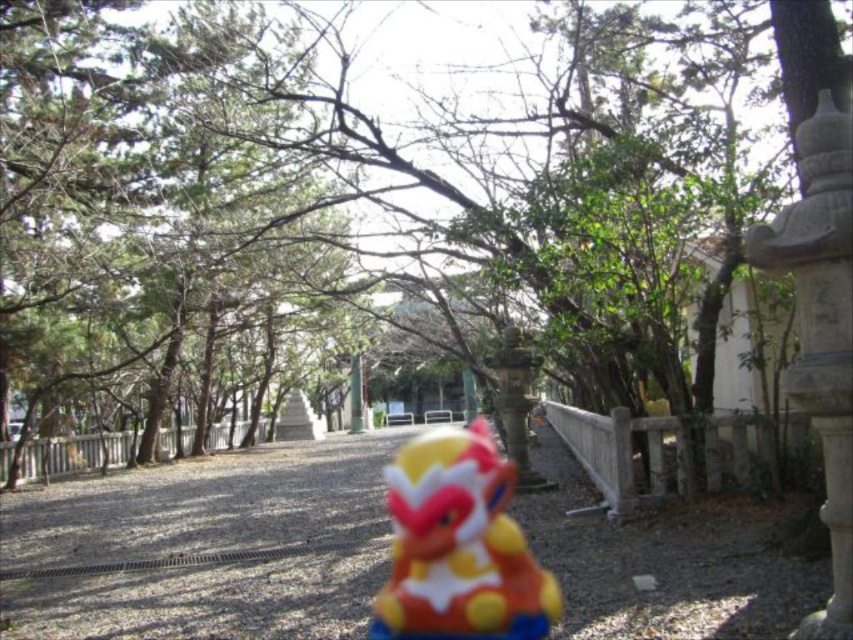
You are a gardener who needs to place a new decorative item on the path. Given the smooth gravel path at center and the matte plastic toy at center, which object is wider and can accommodate the item?

The smooth gravel path at center is wider than the matte plastic toy at center, so it can accommodate the new decorative item.

You are standing at the entrance of the temple grounds and see the point marked at coordinate (202, 547). Is this point located on the gravel path or on the wooden railing?

The point at coordinate (202, 547) is on the smooth gravel path at center, so the point is located on the gravel path.

You are a small robot with a width of 30 cm. You are standing at the start of the smooth gravel path at center. There is a matte plastic toy at center blocking your path. Can you navigate around the toy without stepping off the path?

The smooth gravel path at center has a larger size compared to matte plastic toy at center, so yes, the robot can navigate around the toy while staying on the path since the path is wider than the toy.